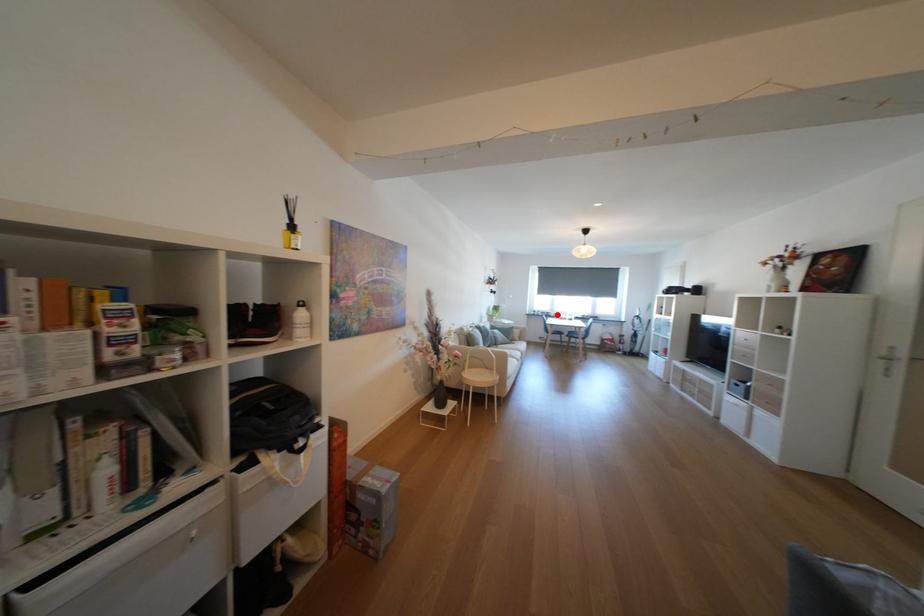
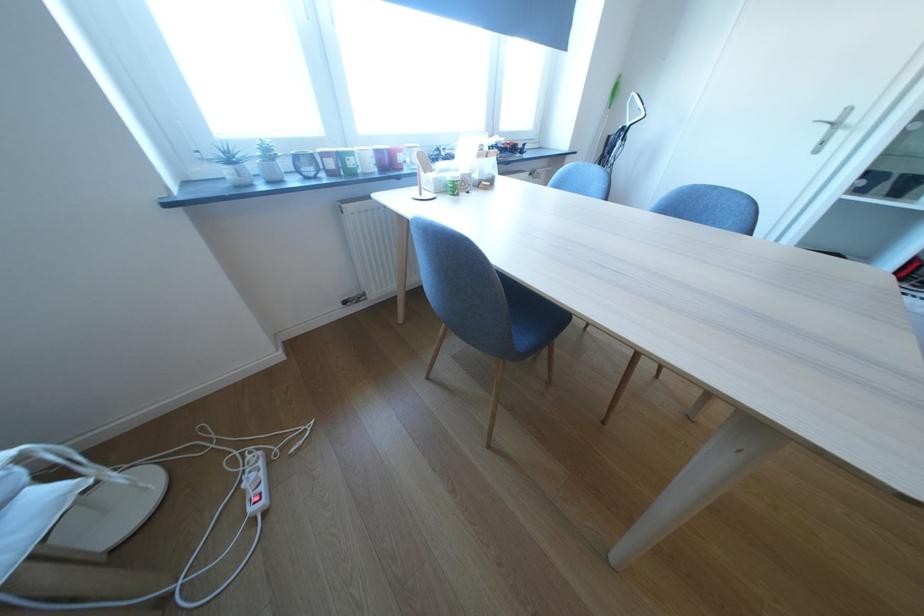
Where in the second image is the point corresponding to the highlighted location from the first image?

(342, 164)